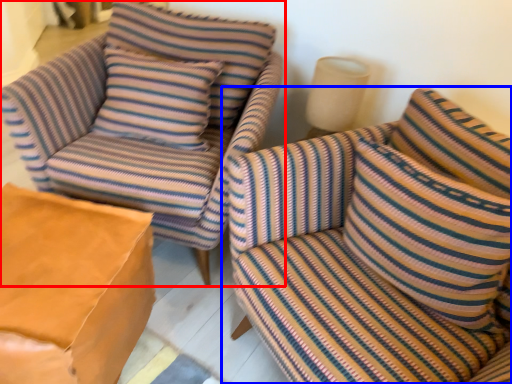
Question: Which point is further to the camera, chair (highlighted by a red box) or studio couch (highlighted by a blue box)?

Choices:
 (A) chair
 (B) studio couch

Answer: (A)